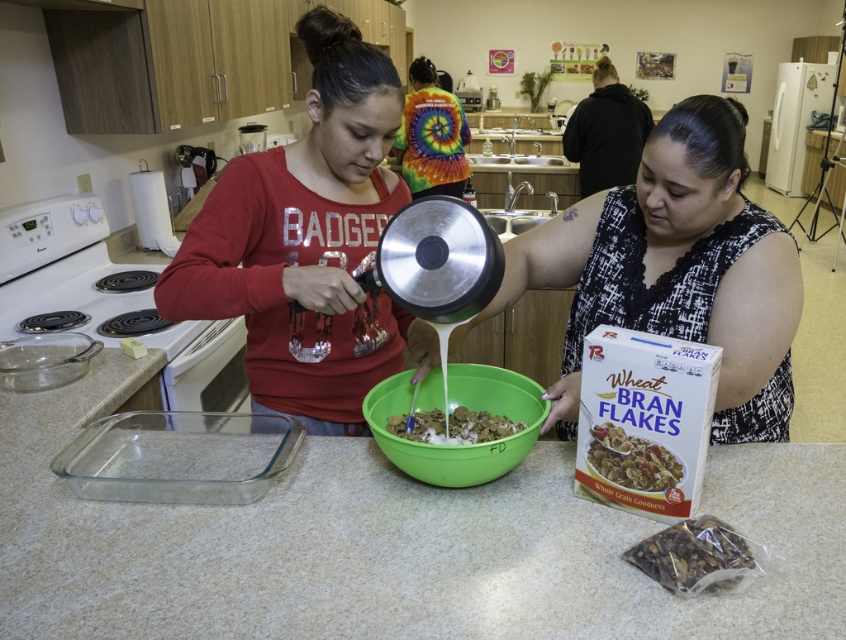
You are a chef preparing a meal and need to place a 10 cm wide saucepan on the smooth white countertop at center and the green plastic bowl at center. Based on their positions, which surface can accommodate the saucepan without it hanging over the edge?

The smooth white countertop at center is to the left of the green plastic bowl at center. Since the saucepan is 10 cm wide, the smooth white countertop at center can accommodate it without the saucepan hanging over the edge, assuming sufficient space exists to the left of the bowl.

You are standing at point (470, 465) in the kitchen. You need to reach the glass baking dish placed to the left of the green bowl. Can you reach it without moving your feet?

The distance between you and the glass baking dish is 3.50 feet. Since the average person can reach about 2 feet without moving, you cannot reach it without moving your feet.

You are a delivery person who needs to place a 12 inch wide package on the smooth white countertop at center. Can you fit it there?

The smooth white countertop at center and camera are 33.34 inches apart from each other. Since the package is 12 inches wide, it can be placed on the countertop as the distance from the camera to the countertop is sufficient to accommodate the package.